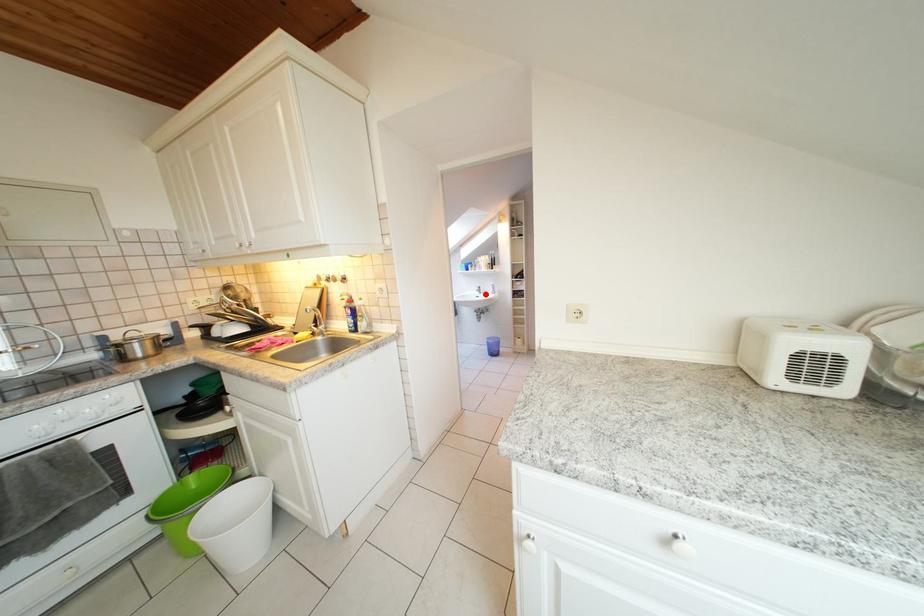
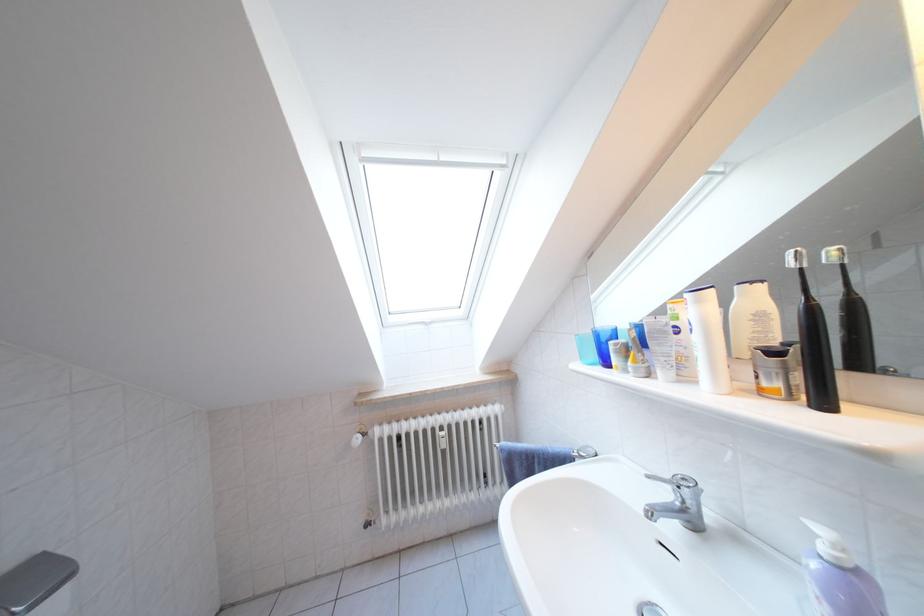
In the second image, find the point that corresponds to the highlighted location in the first image.

(675, 500)